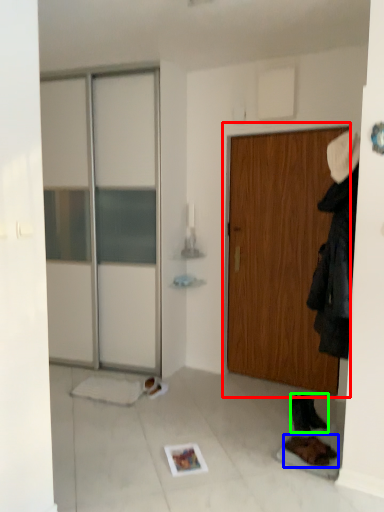
Question: Which is farther away from door (highlighted by a red box)? footwear (highlighted by a blue box) or footwear (highlighted by a green box)?

Choices:
 (A) footwear
 (B) footwear

Answer: (A)